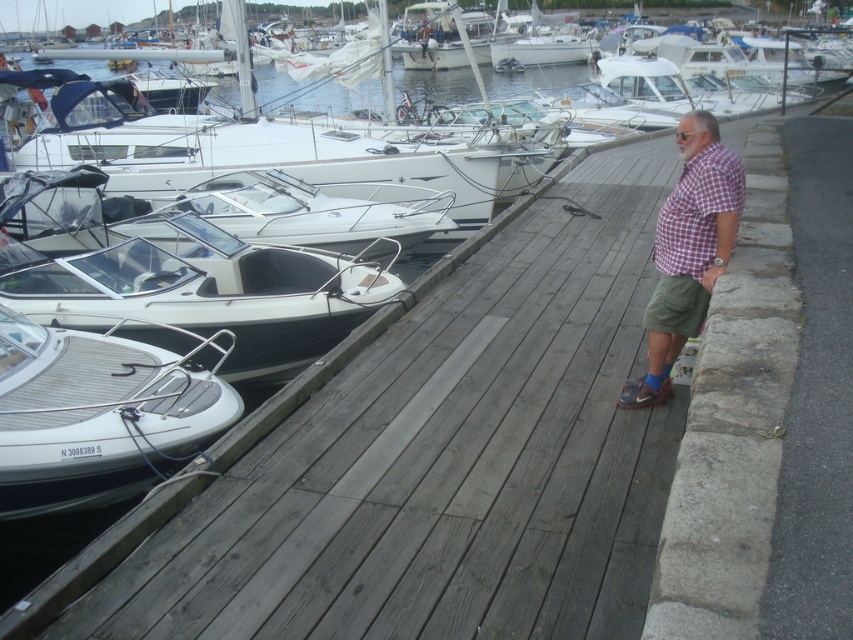
Question: Can you confirm if gray wood dock at center is wider than white glossy boat at left?

Choices:
 (A) no
 (B) yes

Answer: (A)

Question: Which point is farther to the camera?

Choices:
 (A) checkered fabric shirt at center
 (B) white textured boat at left

Answer: (B)

Question: Is gray wood dock at center above checkered fabric shirt at center?

Choices:
 (A) yes
 (B) no

Answer: (B)

Question: Considering the real-world distances, which object is farthest from the gray wood dock at center?

Choices:
 (A) white textured boat at left
 (B) checkered fabric shirt at center
 (C) white glossy boat at left

Answer: (C)

Question: Which point appears farthest from the camera in this image?

Choices:
 (A) (688, 316)
 (B) (117, 240)
 (C) (575, 234)

Answer: (C)

Question: In this image, where is gray wood dock at center located relative to white glossy boat at left?

Choices:
 (A) below
 (B) above

Answer: (A)